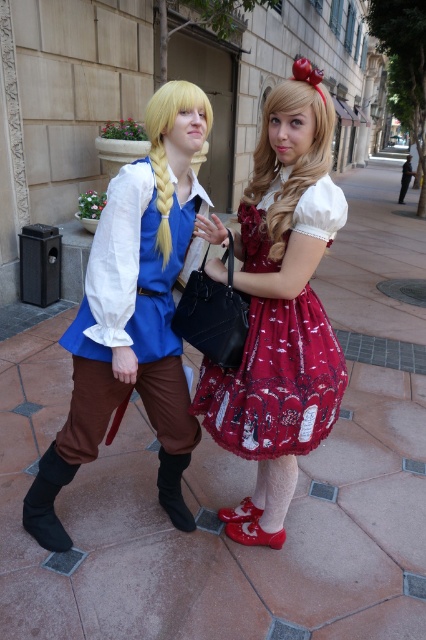
Who is shorter, velvet red dress at center or black leather boot at lower left?

Standing shorter between the two is black leather boot at lower left.

I want to click on velvet red dress at center, so click(276, 381).

How much distance is there between black leather boot at lower left and black suede boot at lower center?

black leather boot at lower left is 21.24 inches away from black suede boot at lower center.

Is black leather boot at lower left thinner than black suede boot at lower center?

No, black leather boot at lower left is not thinner than black suede boot at lower center.

Does point (52, 513) lie in front of point (186, 515)?

Yes, it is in front of point (186, 515).

Locate an element on the screen. black leather boot at lower left is located at coordinates (48, 500).

Can you confirm if matte blue shirt at center is positioned below black suede boot at lower center?

No.

Does matte blue shirt at center have a larger size compared to black suede boot at lower center?

Yes, matte blue shirt at center is bigger than black suede boot at lower center.

Which is in front, point (121, 305) or point (172, 468)?

Point (121, 305) is more forward.

You are a GUI agent. You are given a task and a screenshot of the screen. Output one action in this format:
    pyautogui.click(x=<x>, y=<y>)
    Task: Click on the matte blue shirt at center
    The height and width of the screenshot is (640, 426).
    Given the screenshot: What is the action you would take?
    pyautogui.click(x=132, y=305)